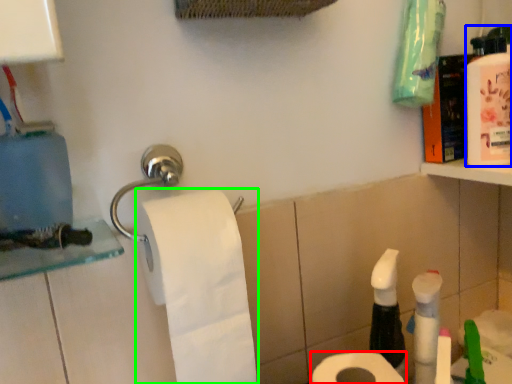
Question: Which is farther away from toilet paper (highlighted by a red box)? mouthwash (highlighted by a blue box) or toilet paper (highlighted by a green box)?

Choices:
 (A) mouthwash
 (B) toilet paper

Answer: (A)